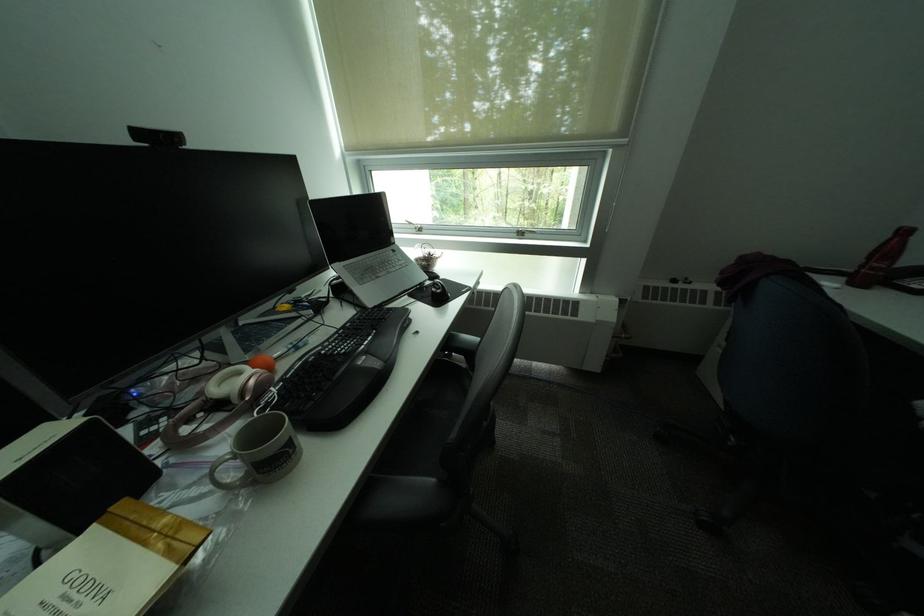
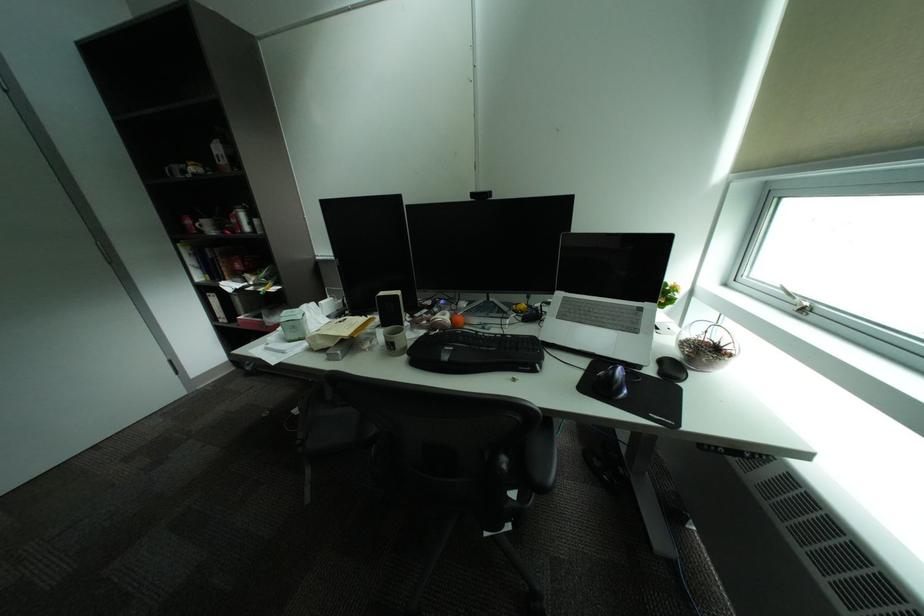
Locate, in the second image, the point that corresponds to [429,231] in the first image.

(808, 310)